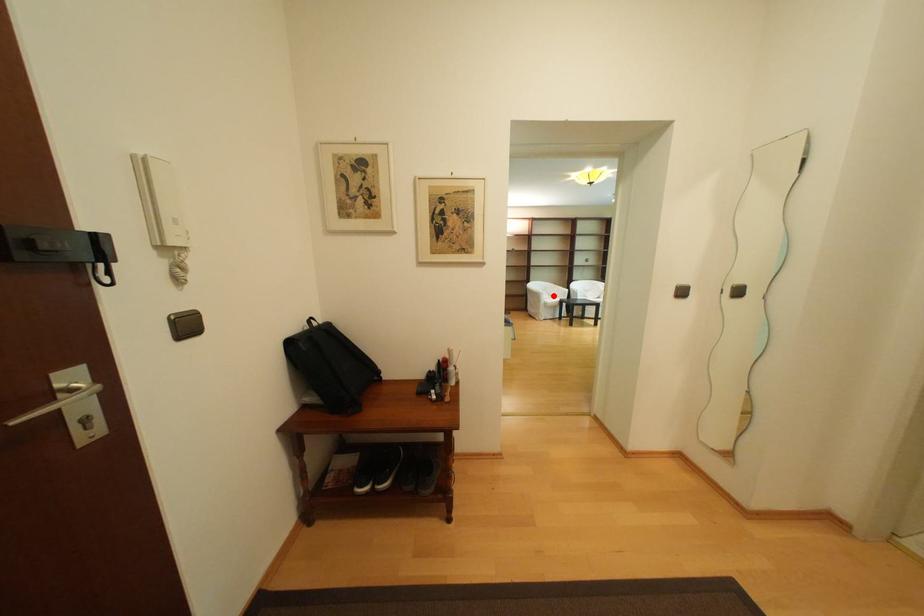
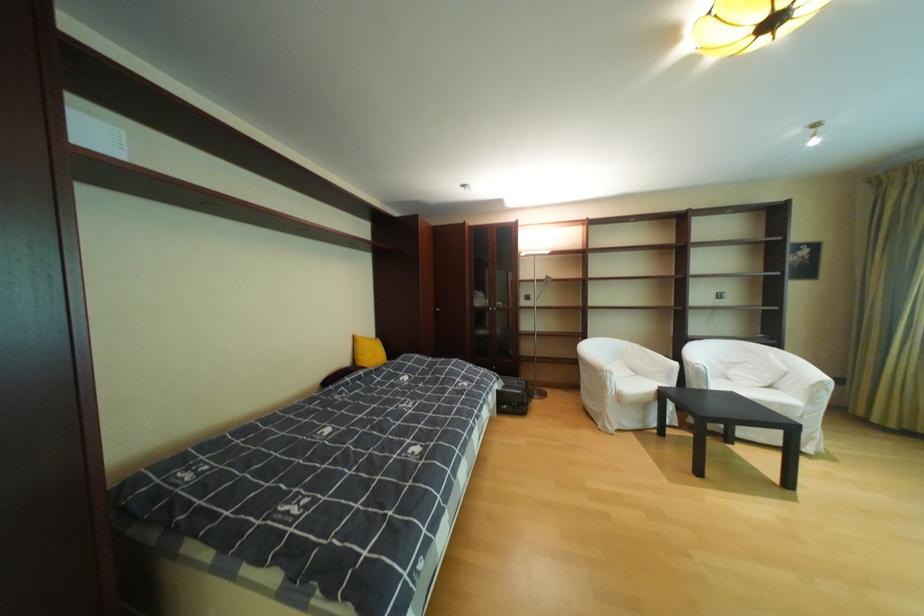
Question: I am providing you with two images of the same scene from different viewpoints. Given a red point in image1, look at the same physical point in image2. Is it:

Choices:
 (A) Closer to the viewpoint
 (B) Farther from the viewpoint

Answer: (B)